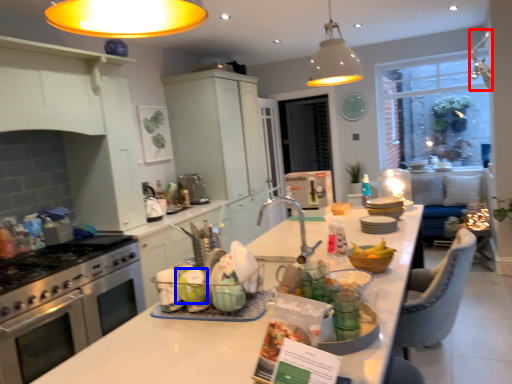
Question: Which object is further to the camera taking this photo, lamp (highlighted by a red box) or table (highlighted by a blue box)?

Choices:
 (A) lamp
 (B) table

Answer: (A)